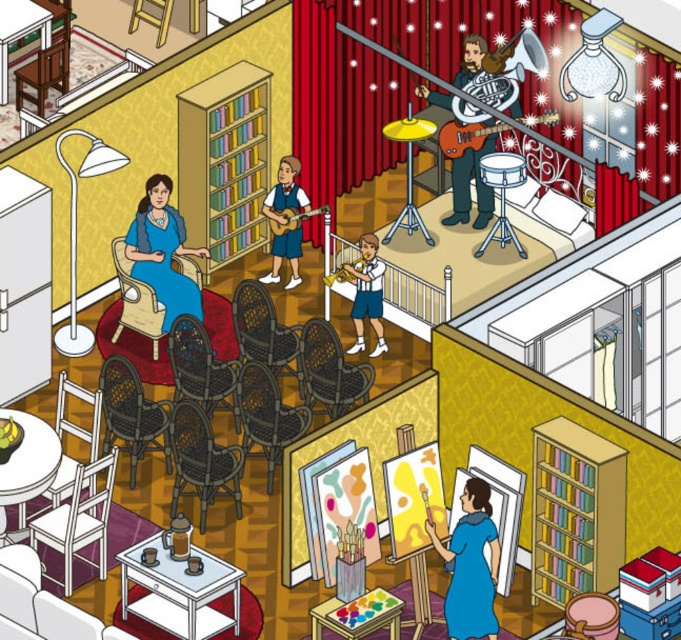
Between wooden acoustic guitar at center and wooden violin at center, which one is positioned higher?

wooden acoustic guitar at center is higher up.

Who is positioned more to the right, wooden acoustic guitar at center or wooden violin at center?

Positioned to the right is wooden violin at center.

At what (x,y) coordinates should I click in order to perform the action: click on wooden acoustic guitar at center. Please return your answer as a coordinate pair (x, y). Image resolution: width=681 pixels, height=640 pixels. Looking at the image, I should click on (291, 218).

Locate an element on the screen. This screenshot has height=640, width=681. wooden acoustic guitar at center is located at coordinates (291, 218).

In the scene shown: Is blue fabric dress at lower center to the right of matte blue dress at left from the viewer's perspective?

Correct, you'll find blue fabric dress at lower center to the right of matte blue dress at left.

Between point (477, 577) and point (165, 308), which one is positioned behind?

Point (165, 308)

Identify the location of blue fabric dress at lower center. Image resolution: width=681 pixels, height=640 pixels. (471, 564).

Who is higher up, blue fabric dress at lower center or wooden violin at center?

wooden violin at center

Which is in front, point (475, 566) or point (345, 278)?

Point (475, 566)

Where is `blue fabric dress at lower center`? blue fabric dress at lower center is located at coordinates tap(471, 564).